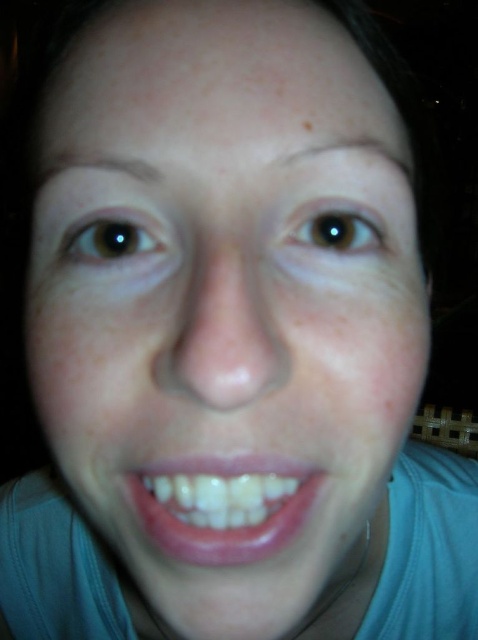
Question: Which object appears closest to the camera in this image?

Choices:
 (A) brown matte eye at upper left
 (B) brown matte eye at upper center
 (C) brown matte freckle at upper center
 (D) glossy pink lips at center

Answer: (D)

Question: Based on their relative distances, which object is farther from the glossy pink lips at center?

Choices:
 (A) brown matte eye at upper center
 (B) brown matte eye at upper left

Answer: (A)

Question: Among these points, which one is nearest to the camera?

Choices:
 (A) (154, 250)
 (B) (321, 216)

Answer: (A)

Question: Does brown matte eye at upper center have a smaller size compared to brown matte freckle at upper center?

Choices:
 (A) no
 (B) yes

Answer: (A)

Question: Is brown matte eye at upper center to the right of brown matte freckle at upper center from the viewer's perspective?

Choices:
 (A) no
 (B) yes

Answer: (B)

Question: Can you confirm if brown matte eye at upper center is positioned to the left of brown matte freckle at upper center?

Choices:
 (A) no
 (B) yes

Answer: (A)